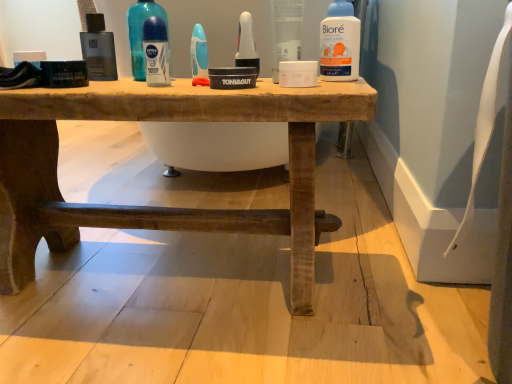
What is the approximate height of transparent plastic deodorant at center, the 3th mouthwash positioned from the right?

4.16 inches.

Where is `white matte jar at center`? The height and width of the screenshot is (384, 512). white matte jar at center is located at coordinates (286, 32).

Considering the sizes of objects transparent plastic deodorant at center, the 3th mouthwash positioned from the right, and rustic wood table at center in the image provided, who is taller, transparent plastic deodorant at center, the 3th mouthwash positioned from the right, or rustic wood table at center?

With more height is rustic wood table at center.

From the image's perspective, who appears lower, transparent plastic deodorant at center, the 2th mouthwash viewed from the left, or rustic wood table at center?

rustic wood table at center appears lower in the image.

Considering the points (145, 65) and (362, 114), which point is in front, point (145, 65) or point (362, 114)?

The point (362, 114) is closer to the camera.

Is white plastic biore at upper center, placed as the 1th cleaning product when sorted from front to back, taller or shorter than blue glossy deodorant at upper center, which is counted as the first cleaning product, starting from the back?

Clearly, white plastic biore at upper center, placed as the 1th cleaning product when sorted from front to back, is shorter compared to blue glossy deodorant at upper center, which is counted as the first cleaning product, starting from the back.

Is white plastic biore at upper center, the second cleaning product positioned from the left, looking in the opposite direction of blue glossy deodorant at upper center, the first cleaning product in the left-to-right sequence?

No, white plastic biore at upper center, the second cleaning product positioned from the left, is not facing the opposite direction of blue glossy deodorant at upper center, the first cleaning product in the left-to-right sequence.

From a real-world perspective, is white plastic biore at upper center, acting as the 1th cleaning product starting from the right, above or below blue glossy deodorant at upper center, which is counted as the first cleaning product, starting from the back?

white plastic biore at upper center, acting as the 1th cleaning product starting from the right, is situated lower than blue glossy deodorant at upper center, which is counted as the first cleaning product, starting from the back, in the real world.

From the picture: Looking at their sizes, would you say white plastic biore at upper center, acting as the 1th cleaning product starting from the right, is wider or thinner than blue glossy deodorant at upper center, which is counted as the first cleaning product, starting from the back?

white plastic biore at upper center, acting as the 1th cleaning product starting from the right, is thinner than blue glossy deodorant at upper center, which is counted as the first cleaning product, starting from the back.

The height and width of the screenshot is (384, 512). Identify the location of the 2nd mouthwash below the white matte jar at center (from a real-world perspective). (246, 44).

Is white plastic toothbrush at center, which is the 1th mouthwash from right to left, facing towards white matte jar at center?

No, white plastic toothbrush at center, which is the 1th mouthwash from right to left, is not turned towards white matte jar at center.

From the image's perspective, is white plastic toothbrush at center, the 4th mouthwash in the left-to-right sequence, located above or below white matte jar at center?

white plastic toothbrush at center, the 4th mouthwash in the left-to-right sequence, is situated lower than white matte jar at center in the image.

Is white plastic toothbrush at center, which is the 1th mouthwash from right to left, completely or partially outside of white matte jar at center?

white plastic toothbrush at center, which is the 1th mouthwash from right to left, lies outside white matte jar at center's area.

Considering the sizes of blue glossy mouthwash at center, the 3th mouthwash viewed from the left, and transparent plastic deodorant at center, the 2th mouthwash viewed from the left, in the image, is blue glossy mouthwash at center, the 3th mouthwash viewed from the left, bigger or smaller than transparent plastic deodorant at center, the 2th mouthwash viewed from the left,?

Considering their sizes, blue glossy mouthwash at center, the 3th mouthwash viewed from the left, takes up less space than transparent plastic deodorant at center, the 2th mouthwash viewed from the left.

Considering the relative positions of blue glossy mouthwash at center, the 2th mouthwash viewed from the right, and transparent plastic deodorant at center, the 3th mouthwash positioned from the right, in the image provided, is blue glossy mouthwash at center, the 2th mouthwash viewed from the right, behind transparent plastic deodorant at center, the 3th mouthwash positioned from the right,?

Yes, blue glossy mouthwash at center, the 2th mouthwash viewed from the right, is further from the viewer.

Is transparent plastic deodorant at center, the 3th mouthwash positioned from the right, at the back of blue glossy mouthwash at center, the 3th mouthwash viewed from the left?

No.

Is blue glossy mouthwash at center, the 2th mouthwash viewed from the right, inside the boundaries of transparent plastic deodorant at center, the 3th mouthwash positioned from the right, or outside?

blue glossy mouthwash at center, the 2th mouthwash viewed from the right, is not inside transparent plastic deodorant at center, the 3th mouthwash positioned from the right, it's outside.

Does point (142, 48) lie in front of point (151, 32)?

No, (142, 48) is further to viewer.

Considering the sizes of blue glossy deodorant at upper center, the first cleaning product in the left-to-right sequence, and transparent plastic deodorant at center, the 3th mouthwash positioned from the right, in the image, is blue glossy deodorant at upper center, the first cleaning product in the left-to-right sequence, wider or thinner than transparent plastic deodorant at center, the 3th mouthwash positioned from the right,?

In the image, blue glossy deodorant at upper center, the first cleaning product in the left-to-right sequence, appears to be wider than transparent plastic deodorant at center, the 3th mouthwash positioned from the right.

Which of these two, blue glossy deodorant at upper center, arranged as the 2th cleaning product when viewed from the right, or transparent plastic deodorant at center, the 3th mouthwash positioned from the right, stands taller?

Standing taller between the two is blue glossy deodorant at upper center, arranged as the 2th cleaning product when viewed from the right.

From a real-world perspective, is matte black bottle at upper left, which ranks as the first mouthwash in left-to-right order, above or below white plastic biore at upper center, the second cleaning product positioned from the left?

matte black bottle at upper left, which ranks as the first mouthwash in left-to-right order, is below white plastic biore at upper center, the second cleaning product positioned from the left.

Is white plastic biore at upper center, the second cleaning product positioned from the left, at the back of matte black bottle at upper left, the fourth mouthwash in the right-to-left sequence?

No.

Which is closer, (87,26) or (334,67)?

The point (334,67) is in front.

Which cleaning product is the 2nd one when counting from the front of the matte black bottle at upper left, which ranks as the first mouthwash in left-to-right order? Please provide its 2D coordinates.

[(340, 43)]

Considering the positions of objects blue glossy deodorant at upper center, which is counted as the first cleaning product, starting from the back, and white matte jar at center in the image provided, who is in front, blue glossy deodorant at upper center, which is counted as the first cleaning product, starting from the back, or white matte jar at center?

white matte jar at center is closer to the camera.

Is blue glossy deodorant at upper center, which is counted as the first cleaning product, starting from the back, oriented away from white matte jar at center?

Yes, white matte jar at center is at the back of blue glossy deodorant at upper center, which is counted as the first cleaning product, starting from the back.

Which is more to the left, blue glossy deodorant at upper center, which is counted as the first cleaning product, starting from the back, or white matte jar at center?

Positioned to the left is blue glossy deodorant at upper center, which is counted as the first cleaning product, starting from the back.

The width and height of the screenshot is (512, 384). Find the location of `table below the transparent plastic deodorant at center, the 3th mouthwash positioned from the right (from the image's perspective)`. table below the transparent plastic deodorant at center, the 3th mouthwash positioned from the right (from the image's perspective) is located at coordinates (160, 207).

In the image, there is a blue glossy deodorant at upper center, arranged as the 2th cleaning product when viewed from the right. At what (x,y) coordinates should I click in order to perform the action: click on cleaning product below it (from a real-world perspective). Please return your answer as a coordinate pair (x, y). The image size is (512, 384). Looking at the image, I should click on (340, 43).

Which object lies further to the anchor point transparent plastic deodorant at center, the 2th mouthwash viewed from the left, matte black bottle at upper left, the fourth mouthwash in the right-to-left sequence, or blue glossy mouthwash at center, the 2th mouthwash viewed from the right?

matte black bottle at upper left, the fourth mouthwash in the right-to-left sequence, lies further to transparent plastic deodorant at center, the 2th mouthwash viewed from the left, than the other object.

Based on their spatial positions, is blue glossy deodorant at upper center, the second cleaning product from the front, or transparent plastic deodorant at center, the 3th mouthwash positioned from the right, closer to blue glossy mouthwash at center, the 2th mouthwash viewed from the right?

The object closer to blue glossy mouthwash at center, the 2th mouthwash viewed from the right, is transparent plastic deodorant at center, the 3th mouthwash positioned from the right.

Considering their positions, is blue glossy deodorant at upper center, which is counted as the first cleaning product, starting from the back, positioned closer to matte black bottle at upper left, which ranks as the first mouthwash in left-to-right order, than blue glossy mouthwash at center, the 2th mouthwash viewed from the right?

blue glossy deodorant at upper center, which is counted as the first cleaning product, starting from the back, is closer to matte black bottle at upper left, which ranks as the first mouthwash in left-to-right order.

Estimate the real-world distances between objects in this image. Which object is further from blue glossy deodorant at upper center, the first cleaning product in the left-to-right sequence, white plastic biore at upper center, the 2th cleaning product viewed from the back, or rustic wood table at center?

The object further to blue glossy deodorant at upper center, the first cleaning product in the left-to-right sequence, is white plastic biore at upper center, the 2th cleaning product viewed from the back.

Based on their spatial positions, is blue glossy deodorant at upper center, the first cleaning product in the left-to-right sequence, or blue glossy mouthwash at center, the 3th mouthwash viewed from the left, further from white plastic toothbrush at center, which is the 1th mouthwash from right to left?

blue glossy deodorant at upper center, the first cleaning product in the left-to-right sequence.

Looking at the image, which one is located further to transparent plastic deodorant at center, the 2th mouthwash viewed from the left, white plastic biore at upper center, acting as the 1th cleaning product starting from the right, or white plastic toothbrush at center, the 4th mouthwash in the left-to-right sequence?

The object further to transparent plastic deodorant at center, the 2th mouthwash viewed from the left, is white plastic biore at upper center, acting as the 1th cleaning product starting from the right.

Estimate the real-world distances between objects in this image. Which object is closer to transparent plastic deodorant at center, the 2th mouthwash viewed from the left, matte black bottle at upper left, which ranks as the first mouthwash in left-to-right order, or blue glossy deodorant at upper center, arranged as the 2th cleaning product when viewed from the right?

blue glossy deodorant at upper center, arranged as the 2th cleaning product when viewed from the right, is closer to transparent plastic deodorant at center, the 2th mouthwash viewed from the left.

Estimate the real-world distances between objects in this image. Which object is further from white plastic biore at upper center, acting as the 1th cleaning product starting from the right, blue glossy deodorant at upper center, which is counted as the first cleaning product, starting from the back, or rustic wood table at center?

blue glossy deodorant at upper center, which is counted as the first cleaning product, starting from the back, is positioned further to the anchor white plastic biore at upper center, acting as the 1th cleaning product starting from the right.

The width and height of the screenshot is (512, 384). In order to click on cleaning product between matte black bottle at upper left, which ranks as the first mouthwash in left-to-right order, and white plastic biore at upper center, acting as the 1th cleaning product starting from the right, in the horizontal direction in this screenshot , I will do `click(142, 32)`.

At what (x,y) coordinates should I click in order to perform the action: click on mouthwash that lies between blue glossy mouthwash at center, the 2th mouthwash viewed from the right, and rustic wood table at center from top to bottom. Please return your answer as a coordinate pair (x, y). Looking at the image, I should click on (156, 52).

This screenshot has width=512, height=384. Identify the location of toiletry between white plastic toothbrush at center, the 4th mouthwash in the left-to-right sequence, and white plastic biore at upper center, placed as the 1th cleaning product when sorted from front to back, in the horizontal direction. (286, 32).

Identify the location of table between blue glossy deodorant at upper center, the first cleaning product in the left-to-right sequence, and white plastic biore at upper center, the 2th cleaning product viewed from the back, in the horizontal direction. (160, 207).